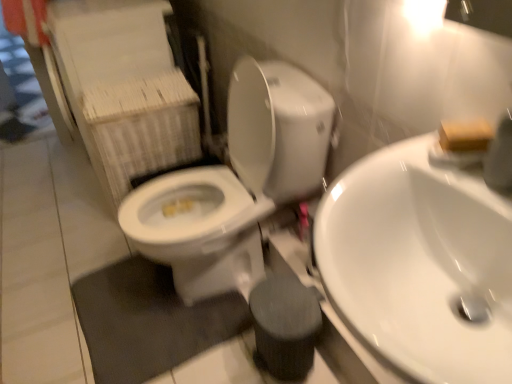
Question: Would you say wooden block at upper right contains white glossy sink at center right?

Choices:
 (A) no
 (B) yes

Answer: (A)

Question: Is wooden block at upper right not within white glossy sink at center right?

Choices:
 (A) no
 (B) yes

Answer: (B)

Question: Could you tell me if wooden block at upper right is turned towards white glossy sink at center right?

Choices:
 (A) yes
 (B) no

Answer: (B)

Question: Does wooden block at upper right appear on the right side of white glossy sink at center right?

Choices:
 (A) yes
 (B) no

Answer: (A)

Question: Is wooden block at upper right next to white glossy sink at center right?

Choices:
 (A) yes
 (B) no

Answer: (B)

Question: Is white glossy toilet at center to the left or to the right of white glossy sink at center right in the image?

Choices:
 (A) left
 (B) right

Answer: (A)

Question: Is white glossy toilet at center bigger or smaller than white glossy sink at center right?

Choices:
 (A) big
 (B) small

Answer: (A)

Question: In terms of width, does white glossy toilet at center look wider or thinner when compared to white glossy sink at center right?

Choices:
 (A) wide
 (B) thin

Answer: (A)

Question: From the image's perspective, is white glossy toilet at center above or below white glossy sink at center right?

Choices:
 (A) above
 (B) below

Answer: (A)

Question: From a real-world perspective, is wooden block at upper right above or below white glossy sink at center right?

Choices:
 (A) below
 (B) above

Answer: (B)

Question: Is wooden block at upper right in front of or behind white glossy sink at center right in the image?

Choices:
 (A) front
 (B) behind

Answer: (B)

Question: Based on their sizes in the image, would you say wooden block at upper right is bigger or smaller than white glossy sink at center right?

Choices:
 (A) small
 (B) big

Answer: (A)

Question: Based on their positions, is wooden block at upper right located to the left or right of white glossy sink at center right?

Choices:
 (A) left
 (B) right

Answer: (B)

Question: Is white glossy sink at center right taller or shorter than white glossy toilet at center?

Choices:
 (A) tall
 (B) short

Answer: (B)

Question: Is point (458, 370) closer or farther from the camera than point (244, 205)?

Choices:
 (A) closer
 (B) farther

Answer: (A)